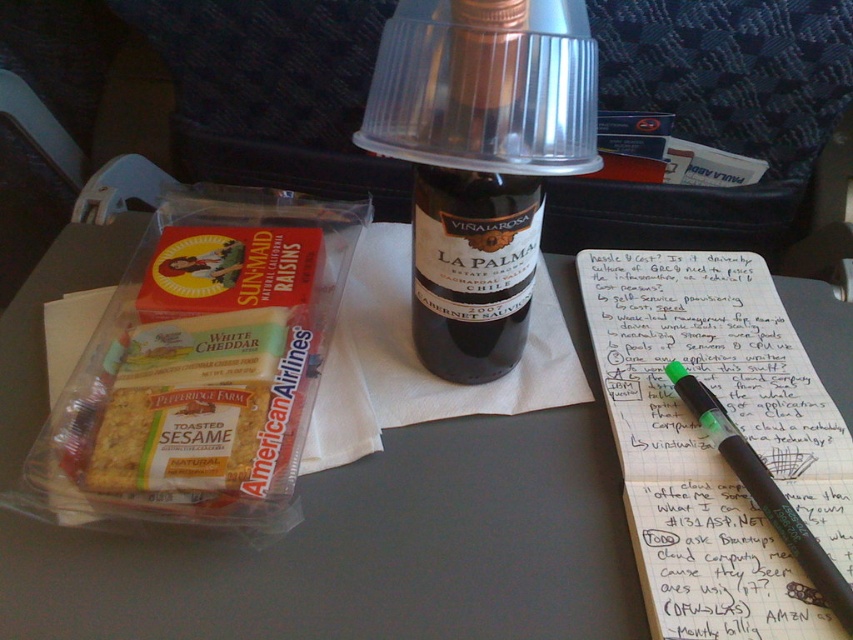
Question: Which of the following is the farthest from the observer?

Choices:
 (A) green pen at upper right
 (B) green matte pen at upper right
 (C) white cheddar cheese at center
 (D) matte plastic tray at center

Answer: (C)

Question: Among these objects, which one is nearest to the camera?

Choices:
 (A) white cheddar cheese at center
 (B) matte plastic tray at center

Answer: (B)

Question: Is matte plastic tray at center below white cheddar cheese at center?

Choices:
 (A) no
 (B) yes

Answer: (B)

Question: Can you confirm if matte plastic tray at center is smaller than white cheddar cheese at center?

Choices:
 (A) yes
 (B) no

Answer: (B)

Question: In this image, where is green pen at upper right located relative to green matte pen at upper right?

Choices:
 (A) above
 (B) below

Answer: (A)

Question: Which point is farther to the camera?

Choices:
 (A) (492, 54)
 (B) (762, 387)

Answer: (B)